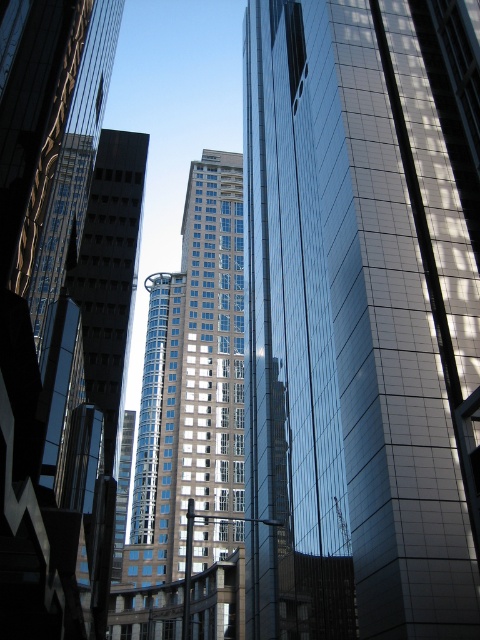
Question: Can you confirm if shiny glass skyscraper at center is thinner than glassy blue skyscraper at center?

Choices:
 (A) no
 (B) yes

Answer: (B)

Question: Which point appears closest to the camera in this image?

Choices:
 (A) (299, 257)
 (B) (182, 486)

Answer: (A)

Question: Does shiny glass skyscraper at center have a lesser width compared to glassy blue skyscraper at center?

Choices:
 (A) no
 (B) yes

Answer: (B)

Question: Does shiny glass skyscraper at center appear on the left side of glassy blue skyscraper at center?

Choices:
 (A) no
 (B) yes

Answer: (A)